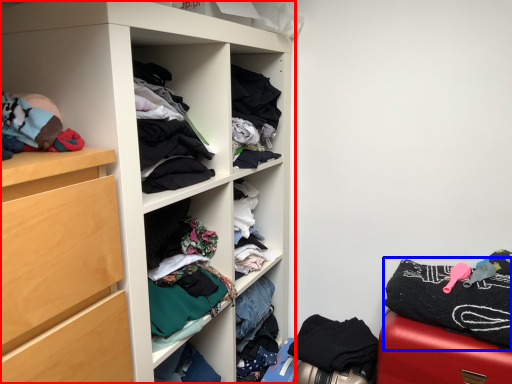
Question: Which object appears closest to the camera in this image, cupboard (highlighted by a red box) or clothing (highlighted by a blue box)?

Choices:
 (A) cupboard
 (B) clothing

Answer: (A)